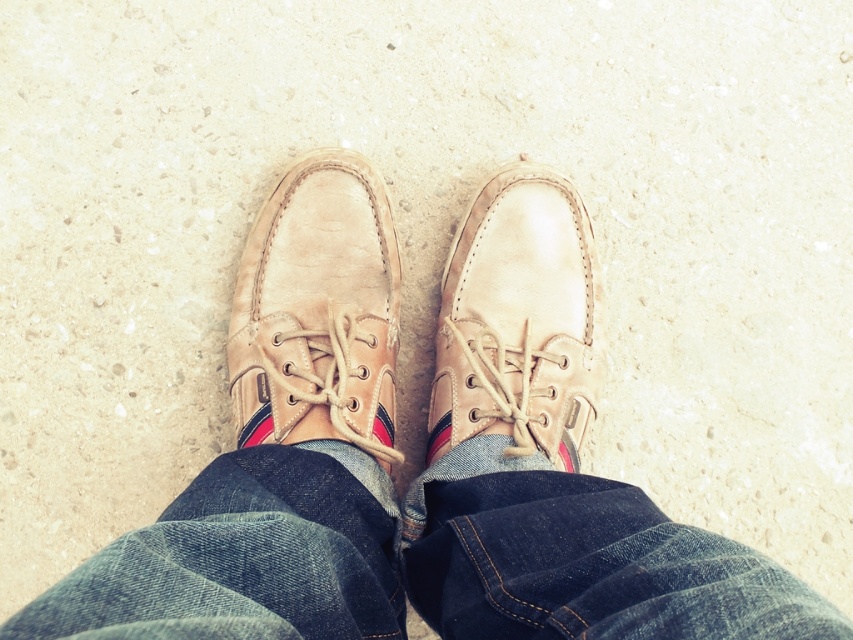
Question: Does leather shoe at center appear over tan leather shoe at center?

Choices:
 (A) no
 (B) yes

Answer: (B)

Question: Is denim at center to the right of leather shoe at center from the viewer's perspective?

Choices:
 (A) yes
 (B) no

Answer: (A)

Question: Which object is positioned farthest from the leather shoe at center?

Choices:
 (A) tan leather shoe at center
 (B) denim at center

Answer: (B)

Question: Considering the real-world distances, which object is farthest from the tan leather shoe at center?

Choices:
 (A) denim at center
 (B) leather shoe at center

Answer: (A)

Question: Is denim at center below tan leather shoe at center?

Choices:
 (A) no
 (B) yes

Answer: (B)

Question: Among these objects, which one is farthest from the camera?

Choices:
 (A) tan leather shoe at center
 (B) leather shoe at center
 (C) denim at center

Answer: (B)